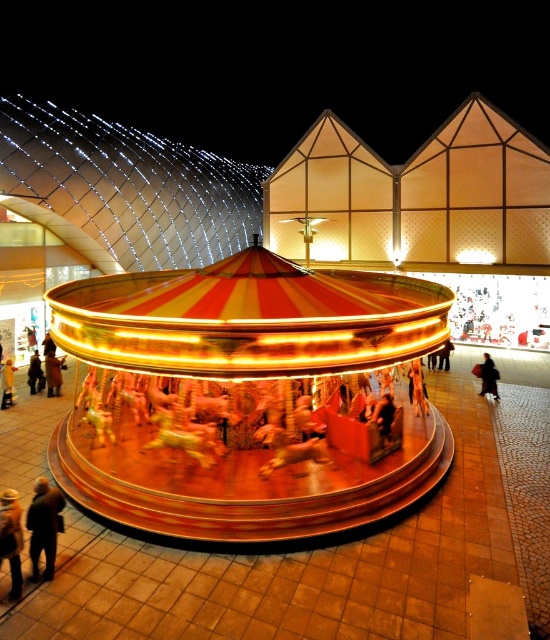
Looking at this image, you are standing at the edge of the carousel area and want to move from the black fabric at center to the brown leather jacket at center. Considering you can walk in a straight line, will you be able to reach the jacket without any obstacles? Please provide your reasoning based on the distance provided.

The distance between the black fabric at center and brown leather jacket at center is 21.57 meters. Since there are no obstacles mentioned in the scene description, you can walk straight to the jacket without any issues.

You are standing in the middle of a park and see the shiny gold carousel at center. If you want to find the shortest path to reach it from your current position, which direction should you move towards?

Since the shiny gold carousel at center is located at coordinates approximately 0.623 on the x axis and 0.449 on the y axis, you should move towards the direction of the center of the park to reach it quickly.

You are at the carousel and see a person wearing an orange fabric jacket at lower left and another wearing a silky yellow dress at center. Which piece of clothing is closer to the ground?

The orange fabric jacket at lower left is below the silky yellow dress at center, so it is closer to the ground.